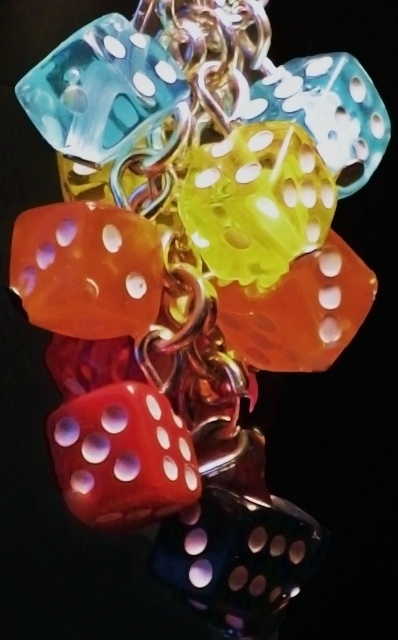
You are an observer looking at the colorful dice arrangement. Which object is positioned closer to you between the translucent yellow dice at center and the translucent blue dice at upper left?

The translucent yellow dice at center is closer to the viewer than the translucent blue dice at upper left.

You are an interior designer planning to hang a decorative chain of dice in a dark room. The dice are translucent and come in various colors. You notice a translucent yellow dice at center marked by point [255,202]. Where exactly is this yellow dice located in the chain?

The translucent yellow dice at center is located at point [255,202] in the chain.